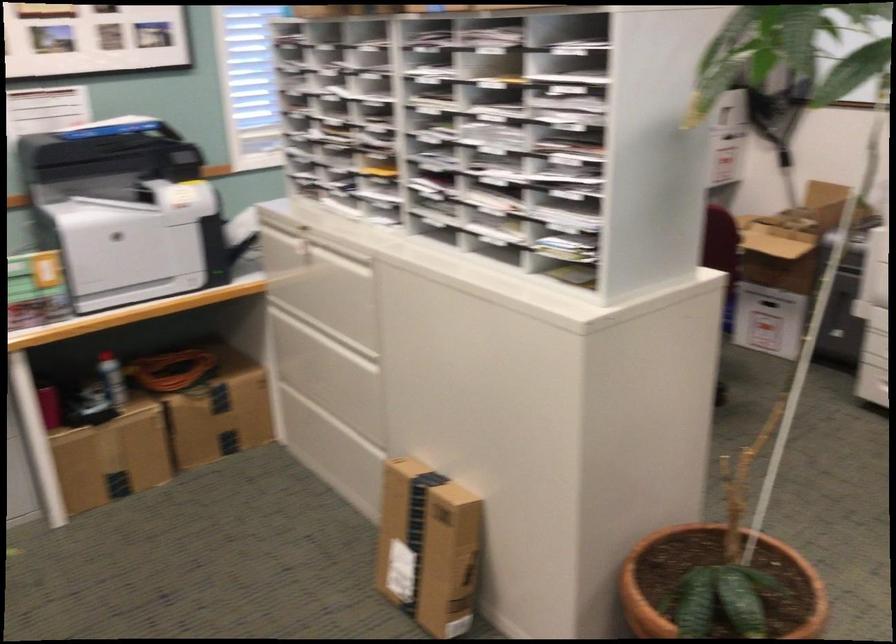
I want to click on red spray can, so click(x=110, y=377).